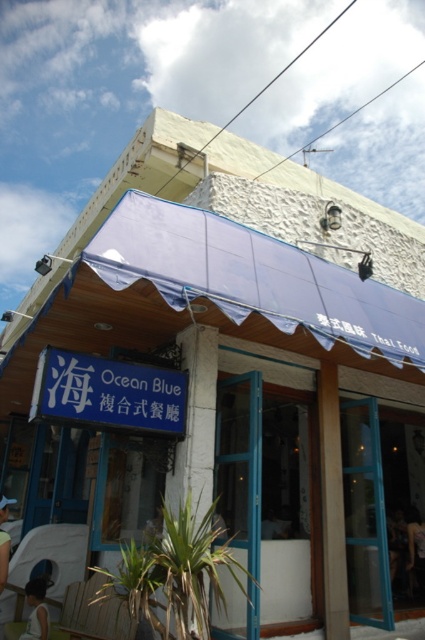
You are standing at the entrance of the restaurant and want to locate the transparent fabric canopy at center. According to the coordinates provided, where exactly is it positioned?

The transparent fabric canopy at center is positioned at coordinates point (x=254, y=278).

What is the exact location of the light skin human at lower left in the image?

The light skin human at lower left is located at point coordinates of (36,611).